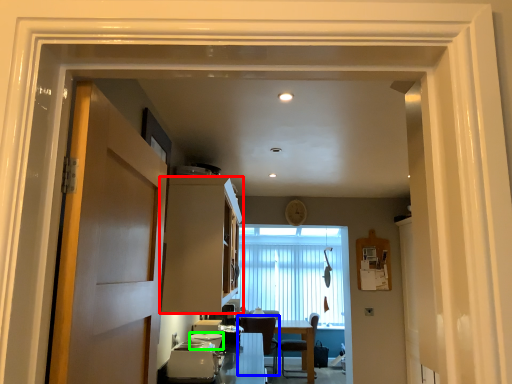
Question: Based on their relative distances, which object is farther from cabinetry (highlighted by a red box)? Choose from chair (highlighted by a blue box) and appliance (highlighted by a green box).

Choices:
 (A) chair
 (B) appliance

Answer: (A)